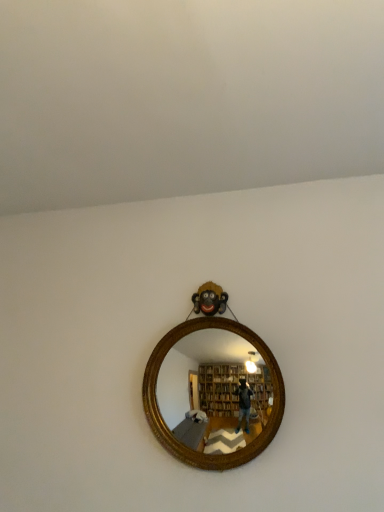
This screenshot has width=384, height=512. Describe the element at coordinates (210, 384) in the screenshot. I see `gold wooden mirror at center` at that location.

Where is `gold wooden mirror at center`? The height and width of the screenshot is (512, 384). gold wooden mirror at center is located at coordinates (210, 384).

Locate an element on the screen. The image size is (384, 512). gold wooden mirror at center is located at coordinates (210, 384).